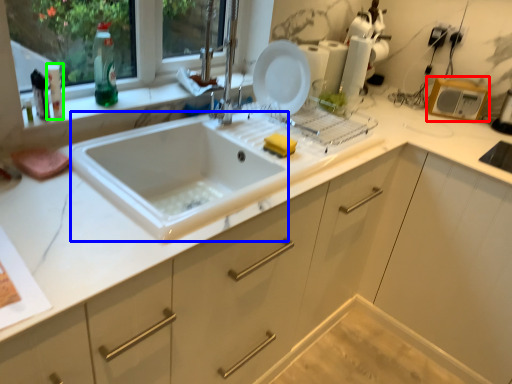
Question: Based on their relative distances, which object is nearer to appliance (highlighted by a red box)? Choose from sink (highlighted by a blue box) and bottle (highlighted by a green box).

Choices:
 (A) sink
 (B) bottle

Answer: (A)